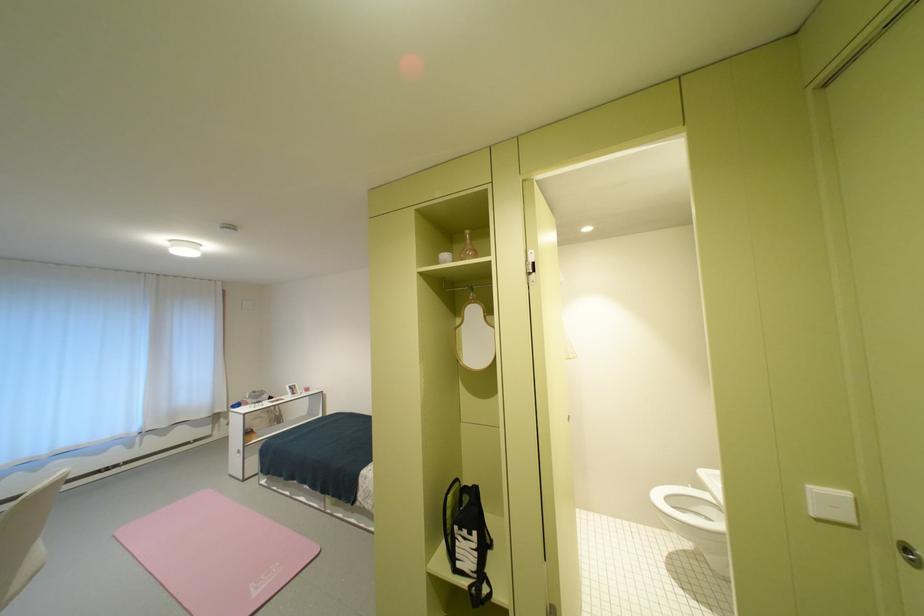
Image resolution: width=924 pixels, height=616 pixels. Identify the location of recessed door handle. (908, 554).